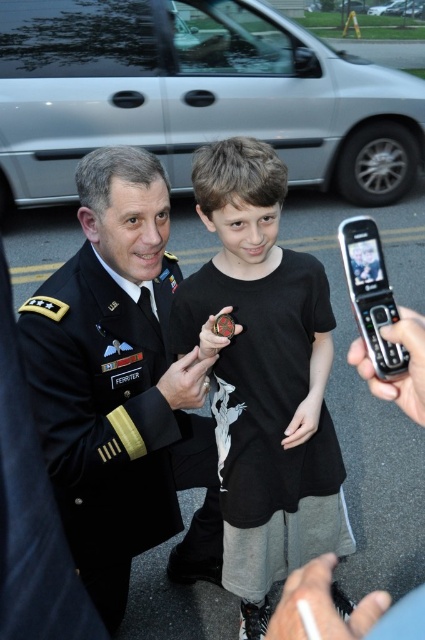
Question: Which of the following is the farthest from the observer?

Choices:
 (A) (x=309, y=348)
 (B) (x=135, y=428)

Answer: (A)

Question: Considering the relative positions of black matte shirt at center and black wool military uniform at center in the image provided, where is black matte shirt at center located with respect to black wool military uniform at center?

Choices:
 (A) left
 (B) right

Answer: (B)

Question: In this image, where is black matte shirt at center located relative to black wool military uniform at center?

Choices:
 (A) below
 (B) above

Answer: (B)

Question: Which of the following is the farthest from the observer?

Choices:
 (A) (337, 531)
 (B) (152, 520)

Answer: (A)

Question: Where is black matte shirt at center located in relation to black wool military uniform at center in the image?

Choices:
 (A) below
 (B) above

Answer: (B)